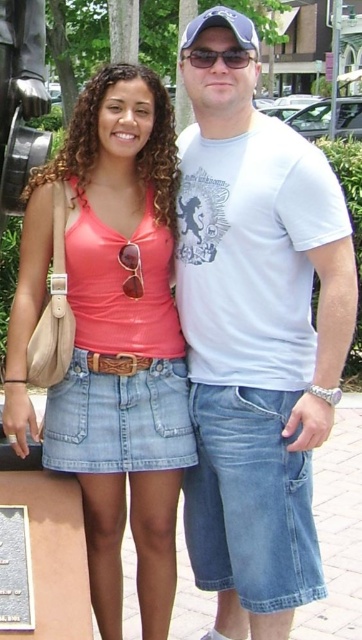
Does white cotton t-shirt at center have a larger size compared to matte coral tank top at center?

Indeed, white cotton t-shirt at center has a larger size compared to matte coral tank top at center.

Who is higher up, white cotton t-shirt at center or matte coral tank top at center?

Positioned higher is white cotton t-shirt at center.

Is point (258, 449) closer to camera compared to point (163, 122)?

Yes, it is.

Locate an element on the screen. The height and width of the screenshot is (640, 362). white cotton t-shirt at center is located at coordinates (254, 332).